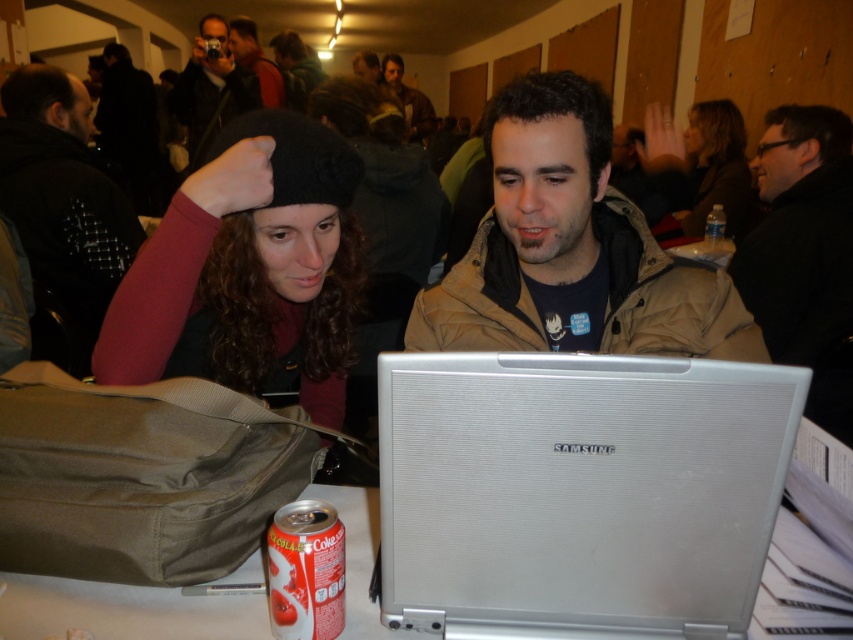
Question: Does silver textured laptop at center appear on the right side of brown leather jacket at upper center?

Choices:
 (A) yes
 (B) no

Answer: (A)

Question: Among these objects, which one is nearest to the camera?

Choices:
 (A) silver textured laptop at center
 (B) matte black camera at upper center
 (C) brown leather jacket at upper center
 (D) black matte jacket at upper right

Answer: (A)

Question: Does beige textured jacket at center have a greater width compared to black fleece jacket at upper left?

Choices:
 (A) no
 (B) yes

Answer: (B)

Question: Among these objects, which one is nearest to the camera?

Choices:
 (A) black matte jacket at upper right
 (B) matte black jacket at upper center
 (C) black wool beret at upper left
 (D) black fleece jacket at upper left

Answer: (C)

Question: Which of these objects is positioned closest to the metallic silver laptop at center?

Choices:
 (A) black fleece jacket at upper left
 (B) silver textured laptop at center

Answer: (B)

Question: Considering the relative positions of black wool beret at upper left and black fleece jacket at upper left in the image provided, where is black wool beret at upper left located with respect to black fleece jacket at upper left?

Choices:
 (A) below
 (B) above

Answer: (A)